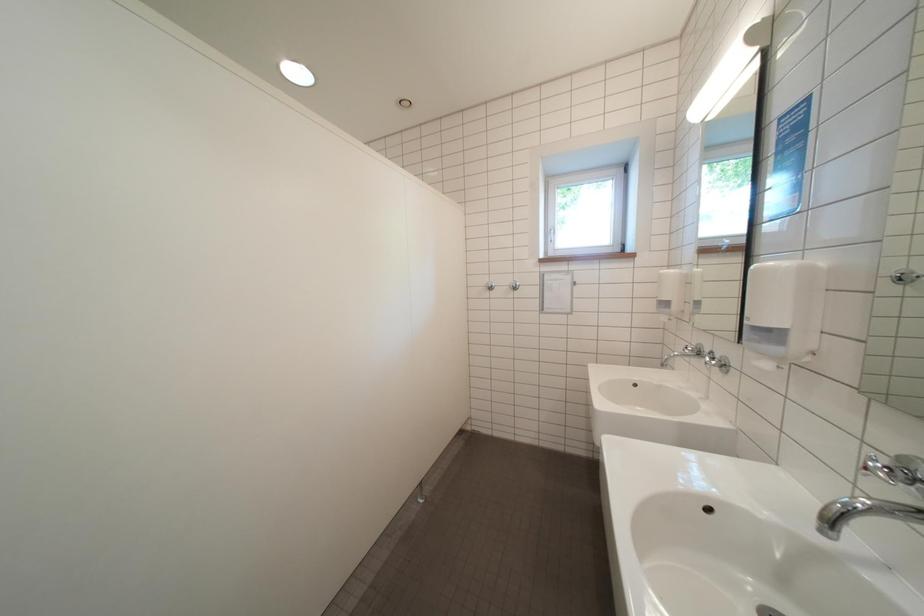
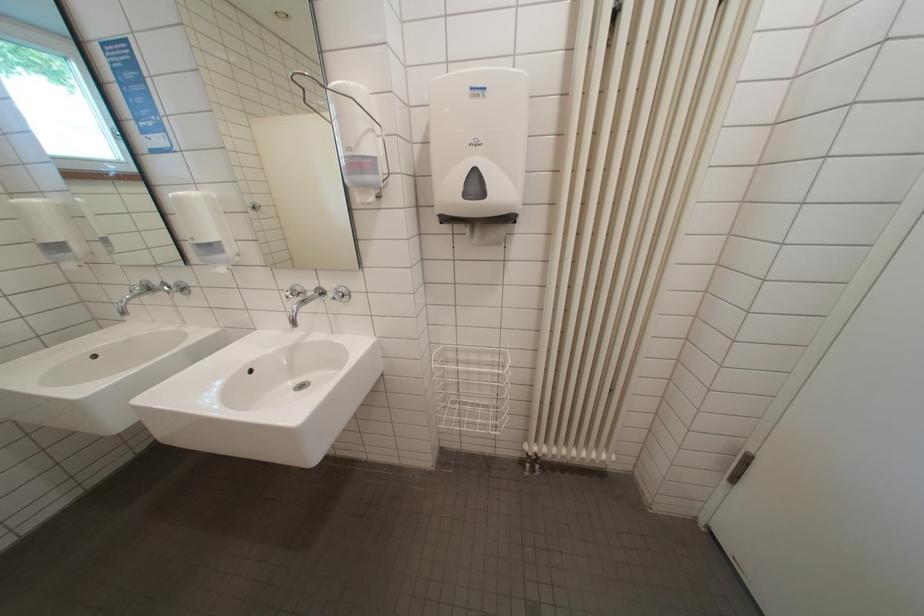
The first image is from the beginning of the video and the second image is from the end. How did the camera likely rotate when shooting the video?

The camera rotated toward right-down.